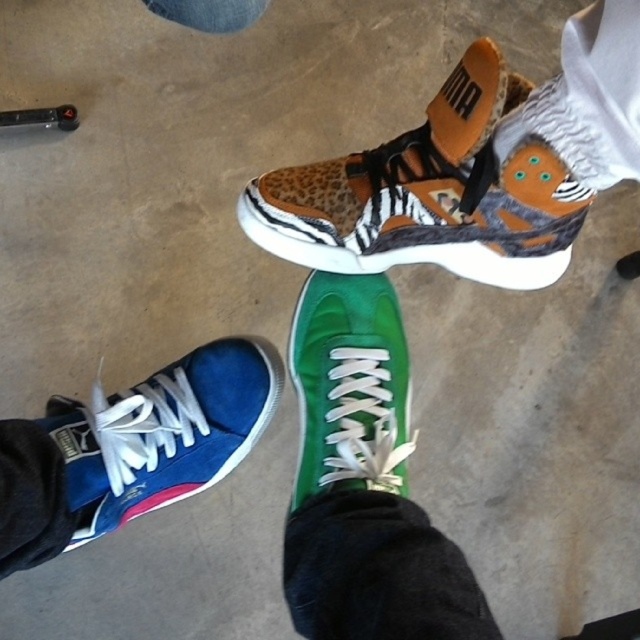
Between leopard print fabric sneaker at upper center and blue suede sneaker at lower left, which one has less height?

leopard print fabric sneaker at upper center

Can you confirm if leopard print fabric sneaker at upper center is shorter than blue suede sneaker at lower left?

Correct, leopard print fabric sneaker at upper center is not as tall as blue suede sneaker at lower left.

Is point (256, 196) farther from camera compared to point (164, 428)?

No, it is in front of (164, 428).

Locate an element on the screen. The image size is (640, 640). leopard print fabric sneaker at upper center is located at coordinates (429, 195).

Does blue suede sneaker at lower left appear under green suede sneaker at center?

Indeed, blue suede sneaker at lower left is positioned under green suede sneaker at center.

Which of these two, blue suede sneaker at lower left or green suede sneaker at center, stands shorter?

Standing shorter between the two is blue suede sneaker at lower left.

Who is more distant from viewer, (172,452) or (371,304)?

The point (172,452) is behind.

The width and height of the screenshot is (640, 640). What are the coordinates of `blue suede sneaker at lower left` in the screenshot? It's located at pyautogui.click(x=163, y=433).

Measure the distance between leopard print fabric sneaker at upper center and green suede sneaker at center.

They are 5.83 inches apart.

Between point (240, 224) and point (376, 362), which one is positioned behind?

Point (240, 224)

This screenshot has width=640, height=640. I want to click on leopard print fabric sneaker at upper center, so click(429, 195).